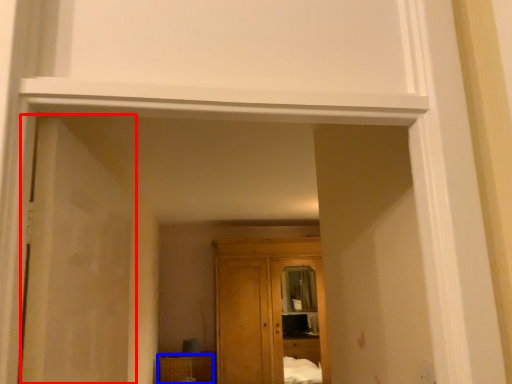
Question: Which object is closer to the camera taking this photo, door (highlighted by a red box) or cabinetry (highlighted by a blue box)?

Choices:
 (A) door
 (B) cabinetry

Answer: (A)